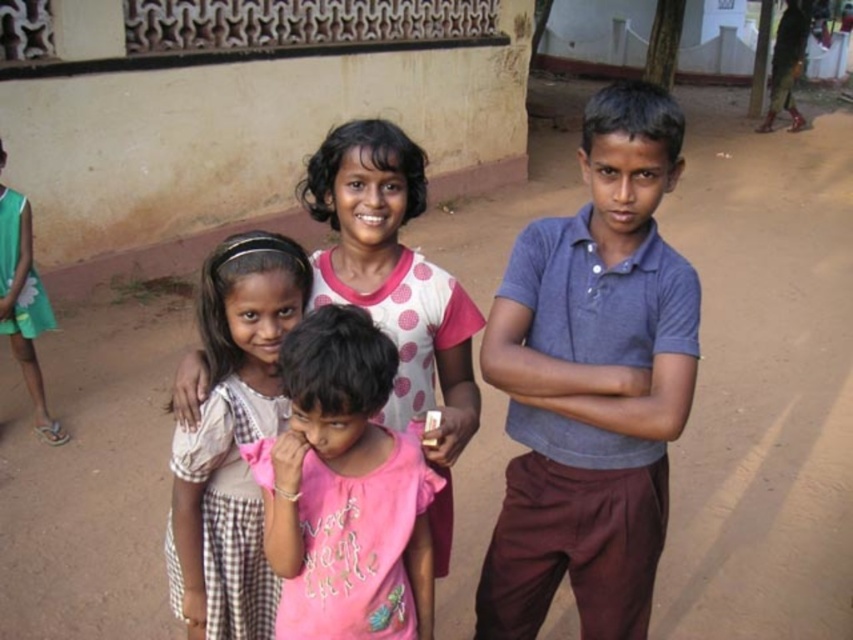
Question: Which of the following is the closest to the observer?

Choices:
 (A) (242, 449)
 (B) (656, 259)
 (C) (247, 520)

Answer: (A)

Question: Is gray cotton shirt at center further to the viewer compared to pink cotton shirt at center?

Choices:
 (A) no
 (B) yes

Answer: (B)

Question: Does gray cotton shirt at center have a smaller size compared to pink fabric at center?

Choices:
 (A) no
 (B) yes

Answer: (A)

Question: Which point is farther from the camera taking this photo?

Choices:
 (A) (590, 465)
 (B) (418, 512)
 (C) (262, 436)

Answer: (A)

Question: Which of these objects is positioned closest to the pink cotton shirt at center?

Choices:
 (A) gray cotton shirt at center
 (B) pink fabric at center

Answer: (B)

Question: Observing the image, what is the correct spatial positioning of gray cotton shirt at center in reference to pink fabric at center?

Choices:
 (A) above
 (B) below

Answer: (A)